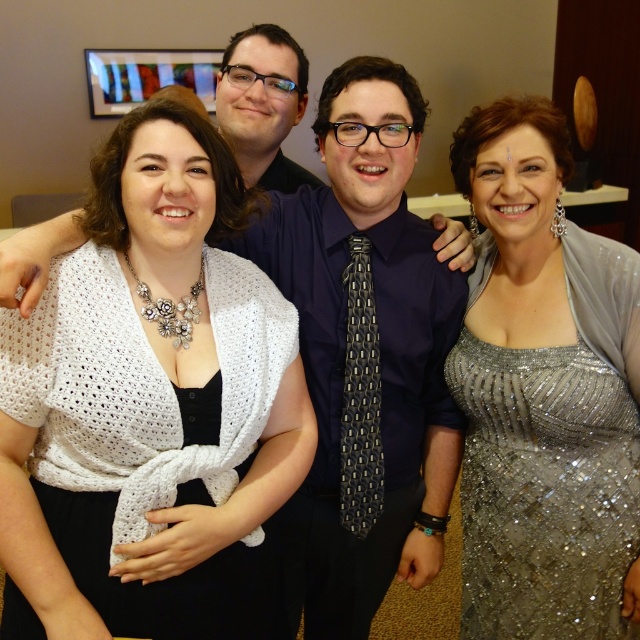
Question: Which point is farther to the camera?

Choices:
 (A) (236, 200)
 (B) (598, 616)

Answer: (B)

Question: Does sparkly silver dress at right appear on the right side of white knitted shawl at center?

Choices:
 (A) yes
 (B) no

Answer: (A)

Question: Can you confirm if sparkly silver dress at right is wider than white knitted shawl at center?

Choices:
 (A) no
 (B) yes

Answer: (A)

Question: Which point is closer to the camera?

Choices:
 (A) (163, 129)
 (B) (564, 148)

Answer: (A)

Question: Can you confirm if sparkly silver dress at right is positioned to the right of white knitted shawl at center?

Choices:
 (A) yes
 (B) no

Answer: (A)